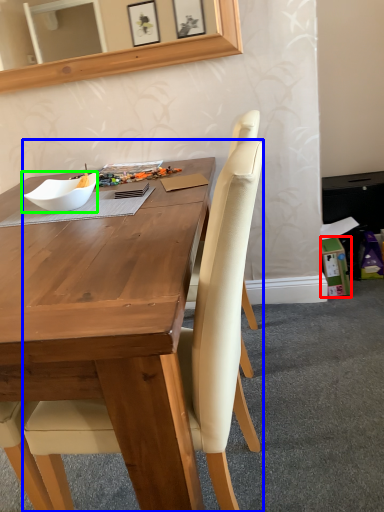
Question: Considering the real-world distances, which object is farthest from box (highlighted by a red box)? chair (highlighted by a blue box) or bowl (highlighted by a green box)?

Choices:
 (A) chair
 (B) bowl

Answer: (A)